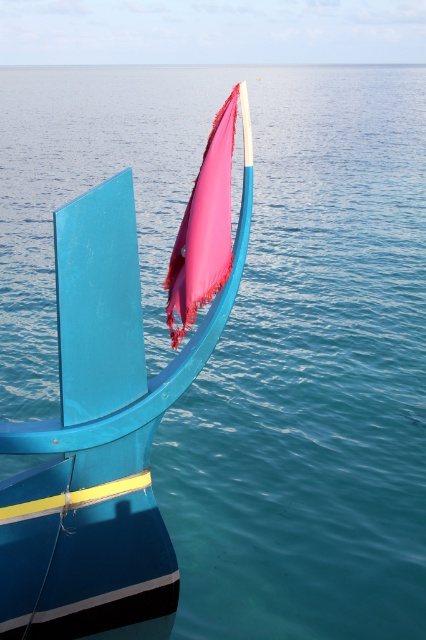
You are standing on the deck of the boat and see the point at coordinates point (x=100, y=435). What is this point located on?

The point (x=100, y=435) is located on the matte blue boat at center.

You are a photographer planning to take a photo of the matte blue boat at center and the pink fabric flag at center. Since you want to emphasize both objects equally, which one should you zoom in on more to balance their sizes in the photo?

The matte blue boat at center is larger in size than the pink fabric flag at center. To balance their sizes, you should zoom in more on the pink fabric flag at center to make it appear larger in the photo.